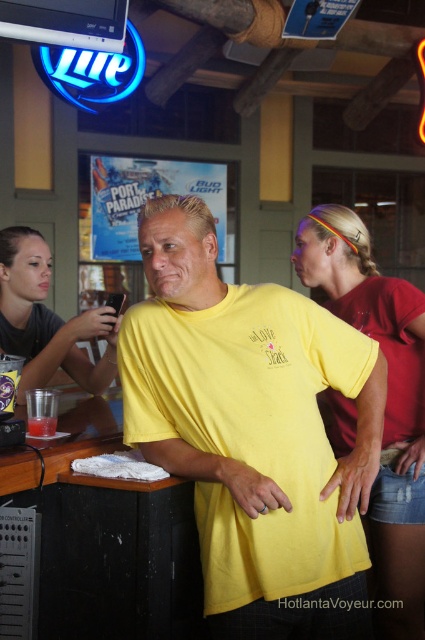
Which is more to the right, yellow cotton t-shirt at center or clear plastic cup at bar left?

yellow cotton t-shirt at center is more to the right.

Does point (316, 592) lie behind point (28, 435)?

No.

Locate an element on the screen. This screenshot has height=640, width=425. yellow cotton t-shirt at center is located at coordinates (252, 433).

Between denim shorts at center and matte gray shirt at center, which one is positioned lower?

Positioned lower is denim shorts at center.

Is denim shorts at center above matte gray shirt at center?

Actually, denim shorts at center is below matte gray shirt at center.

Describe the element at coordinates (385, 401) in the screenshot. This screenshot has width=425, height=640. I see `denim shorts at center` at that location.

The image size is (425, 640). I want to click on denim shorts at center, so click(x=385, y=401).

Which is more to the right, denim shorts at center or clear plastic cup at bar left?

denim shorts at center is more to the right.

In order to click on denim shorts at center in this screenshot , I will do `click(385, 401)`.

Find the location of `denim shorts at center`. denim shorts at center is located at coordinates (385, 401).